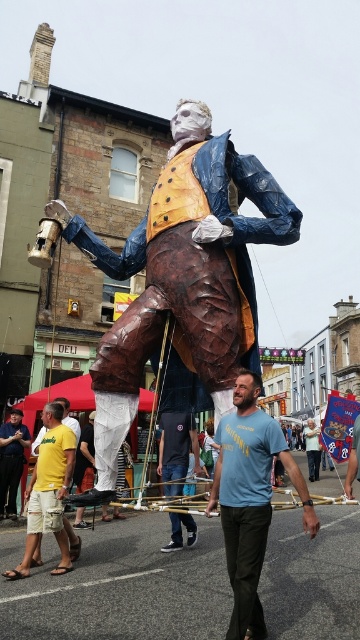
Question: Which of the following is the farthest from the observer?

Choices:
 (A) (251, 602)
 (B) (19, 438)
 (C) (176, 524)
 (D) (249, 296)

Answer: (B)

Question: Can you confirm if denim pants at center is thinner than matte blue shirt at center?

Choices:
 (A) no
 (B) yes

Answer: (A)

Question: Is bronze statue at center above denim pants at center?

Choices:
 (A) yes
 (B) no

Answer: (A)

Question: Among these objects, which one is farthest from the camera?

Choices:
 (A) matte blue shirt at center
 (B) bronze statue at center
 (C) blue cotton t-shirt at center
 (D) denim pants at center

Answer: (A)

Question: Which point is farther to the camera?

Choices:
 (A) matte blue shirt at center
 (B) blue cotton t-shirt at center

Answer: (A)

Question: Can you confirm if blue cotton t-shirt at center is bigger than matte blue shirt at center?

Choices:
 (A) yes
 (B) no

Answer: (A)